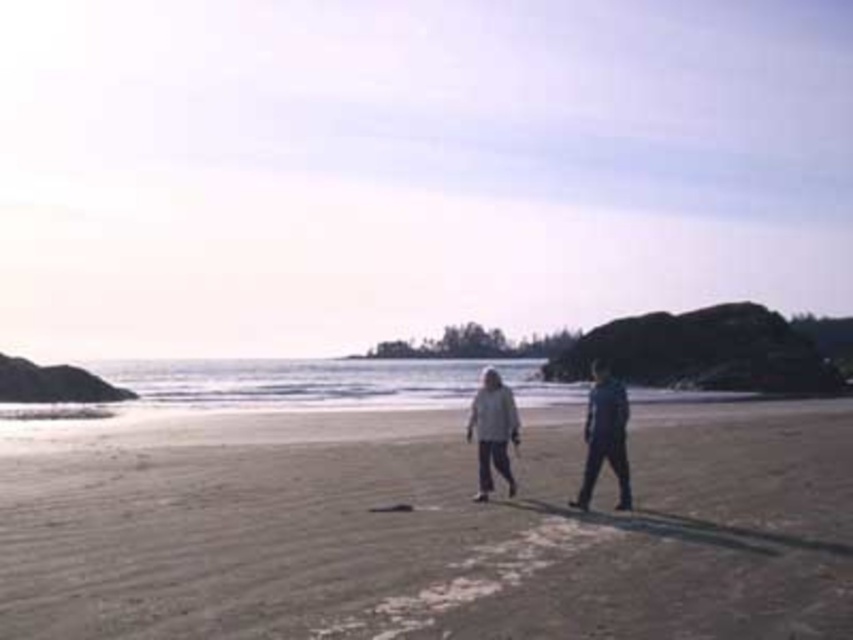
Which is in front, point (26, 627) or point (601, 403)?

Point (26, 627)

Is smooth sand at center to the right of dark blue fabric pants at right from the viewer's perspective?

In fact, smooth sand at center is to the left of dark blue fabric pants at right.

Is point (310, 476) closer to viewer compared to point (590, 419)?

No.

Image resolution: width=853 pixels, height=640 pixels. I want to click on smooth sand at center, so click(x=437, y=532).

This screenshot has width=853, height=640. What do you see at coordinates (605, 435) in the screenshot? I see `white fabric couple at center` at bounding box center [605, 435].

Does white fabric couple at center have a lesser height compared to dark blue fabric pants at right?

No.

I want to click on white fabric couple at center, so click(605, 435).

Locate an element on the screen. This screenshot has width=853, height=640. white fabric couple at center is located at coordinates (605, 435).

Who is more distant from viewer, (177, 486) or (492, 444)?

The point (177, 486) is more distant.

Can you confirm if smooth sand at center is smaller than white fabric couple at center?

Correct, smooth sand at center occupies less space than white fabric couple at center.

I want to click on smooth sand at center, so click(x=437, y=532).